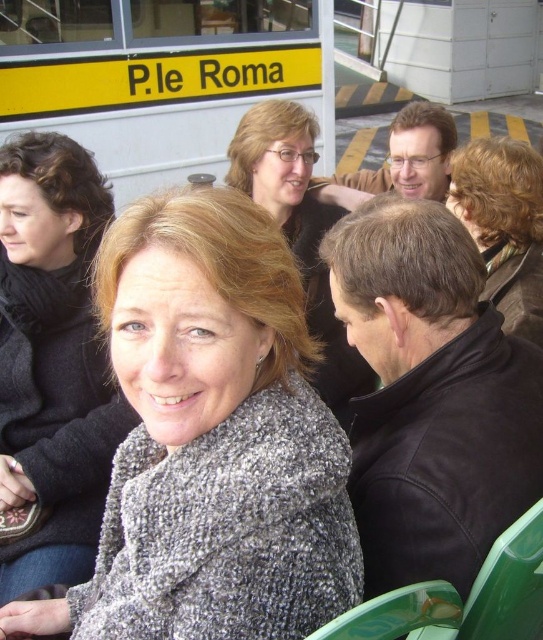
You are a fashion designer observing the scene at P.le Roma. You notice the gray knitted shawl at center and the smooth black jacket at center. Which item is placed lower on the person?

The gray knitted shawl at center is positioned under the smooth black jacket at center, so it is placed lower on the person.